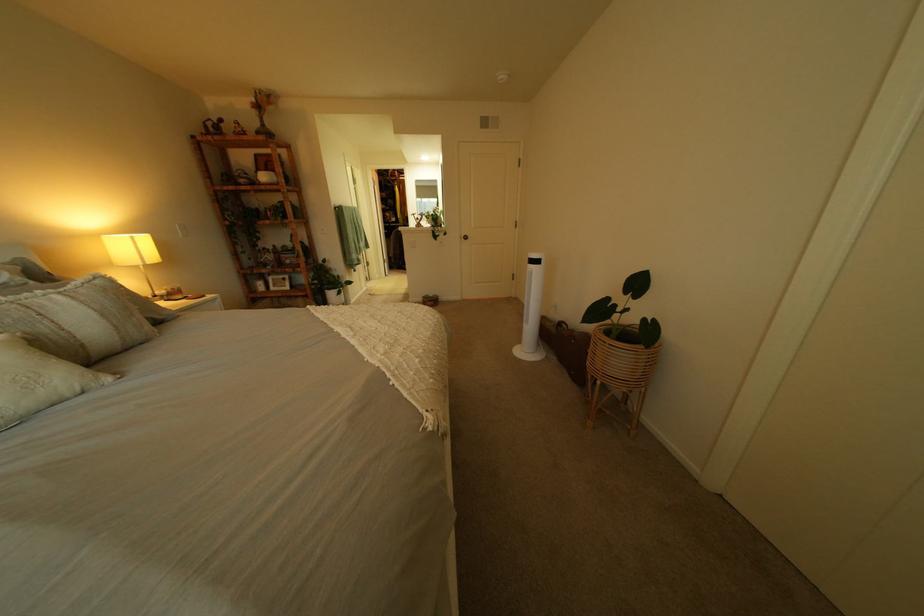
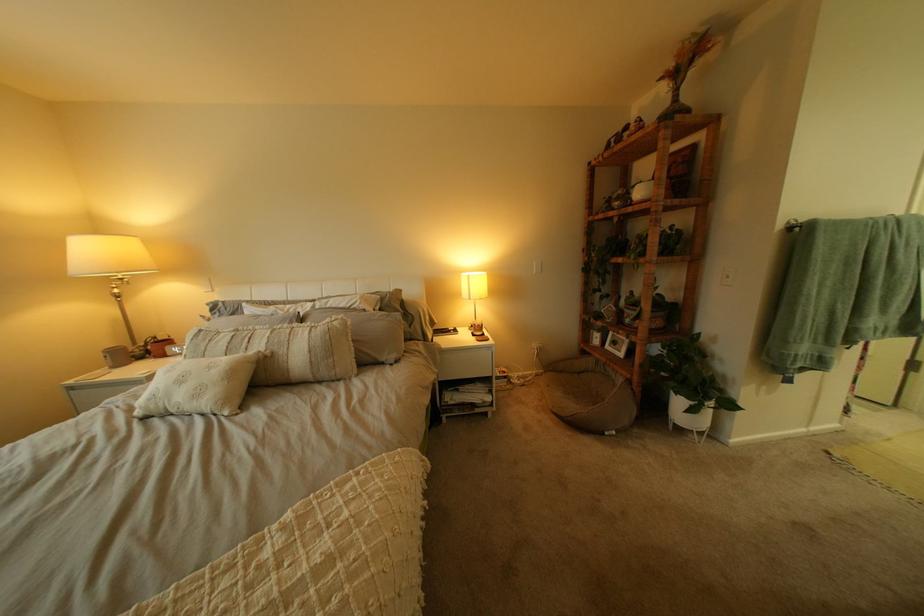
Find the pixel in the second image that matches [149,238] in the first image.

(483, 277)